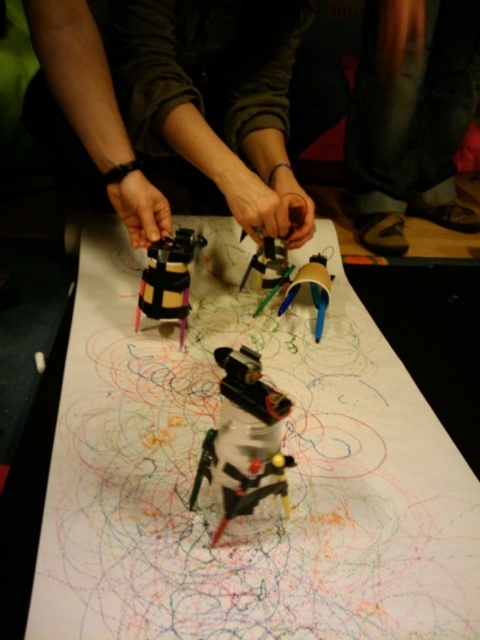
Question: Which of these objects is positioned farthest from the white paper at center?

Choices:
 (A) dark gray pants at lower center
 (B) matte plastic cup at center
 (C) metallic plastic robot at center

Answer: (A)

Question: Which point is farther to the camera?

Choices:
 (A) white paper at center
 (B) metallic plastic robot at center
 (C) matte plastic toy at center
 (D) dark gray pants at lower center

Answer: (D)

Question: Does white paper at center come in front of matte plastic cup at center?

Choices:
 (A) yes
 (B) no

Answer: (A)

Question: Is metallic plastic robot at center behind matte plastic toy at center?

Choices:
 (A) yes
 (B) no

Answer: (B)

Question: Does matte black robot at center appear under metallic plastic robot at center?

Choices:
 (A) yes
 (B) no

Answer: (B)

Question: Which object is positioned closest to the white paper at center?

Choices:
 (A) metallic plastic robot at center
 (B) matte plastic cup at center
 (C) matte plastic toy at center

Answer: (A)